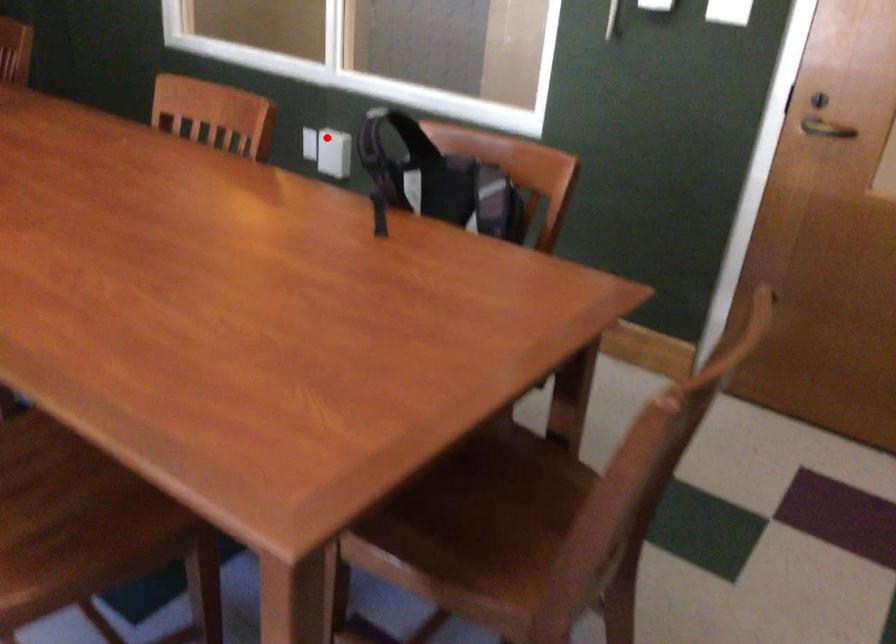
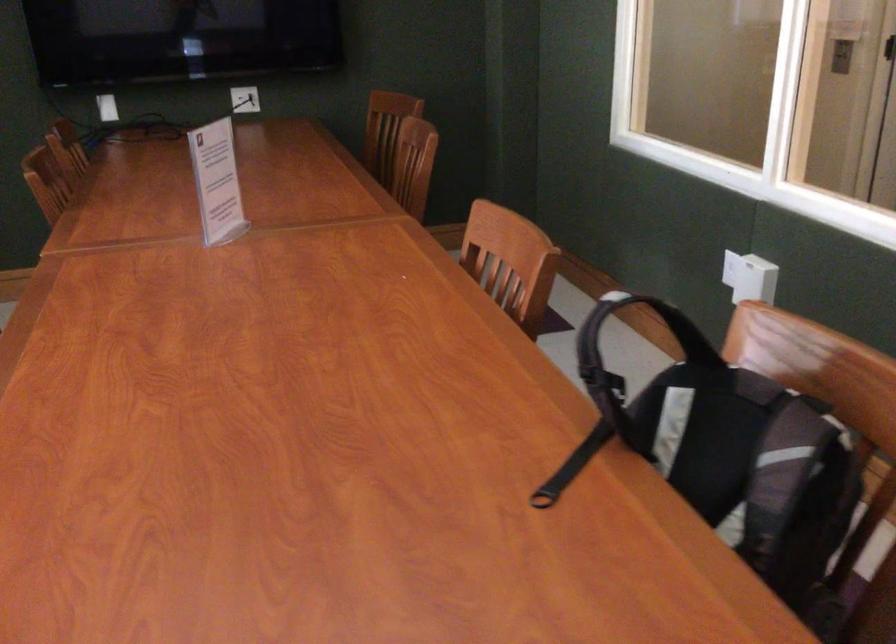
In the second image, find the point that corresponds to the highlighted location in the first image.

(742, 269)